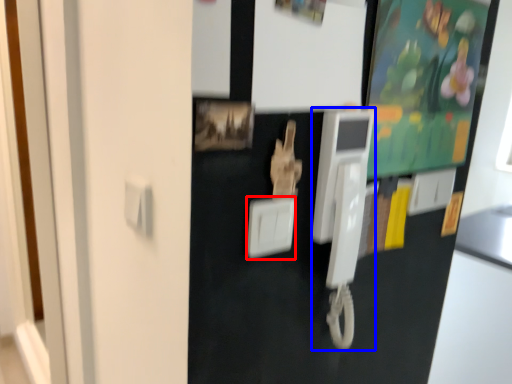
Question: Which object appears farthest to the camera in this image, light switch (highlighted by a red box) or payphone (highlighted by a blue box)?

Choices:
 (A) light switch
 (B) payphone

Answer: (B)